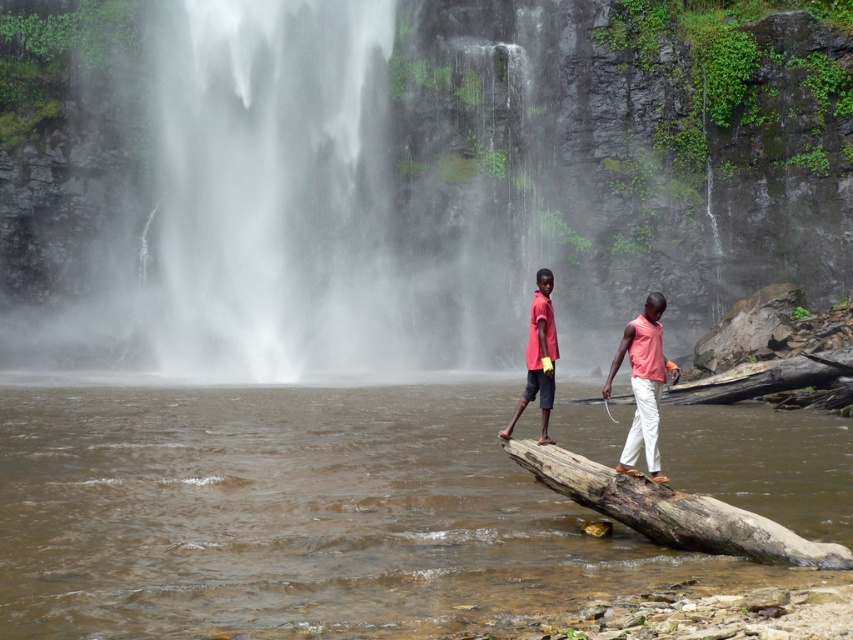
Between brown muddy water at center and brown weathered log at center, which one is positioned lower?

brown weathered log at center is below.

What are the coordinates of `brown muddy water at center` in the screenshot? It's located at (294, 515).

Find the location of a particular element. The image size is (853, 640). brown muddy water at center is located at coordinates (294, 515).

Consider the image. Which is more to the left, brown muddy water at center or matte red shorts at center?

Positioned to the left is brown muddy water at center.

The width and height of the screenshot is (853, 640). In order to click on brown muddy water at center in this screenshot , I will do 294,515.

This screenshot has height=640, width=853. Find the location of `brown muddy water at center`. brown muddy water at center is located at coordinates (294, 515).

Is point (614, 508) positioned before point (537, 328)?

Yes, point (614, 508) is closer to viewer.

Does point (722, 515) lie behind point (537, 376)?

No.

Locate an element on the screen. brown weathered log at center is located at coordinates (671, 509).